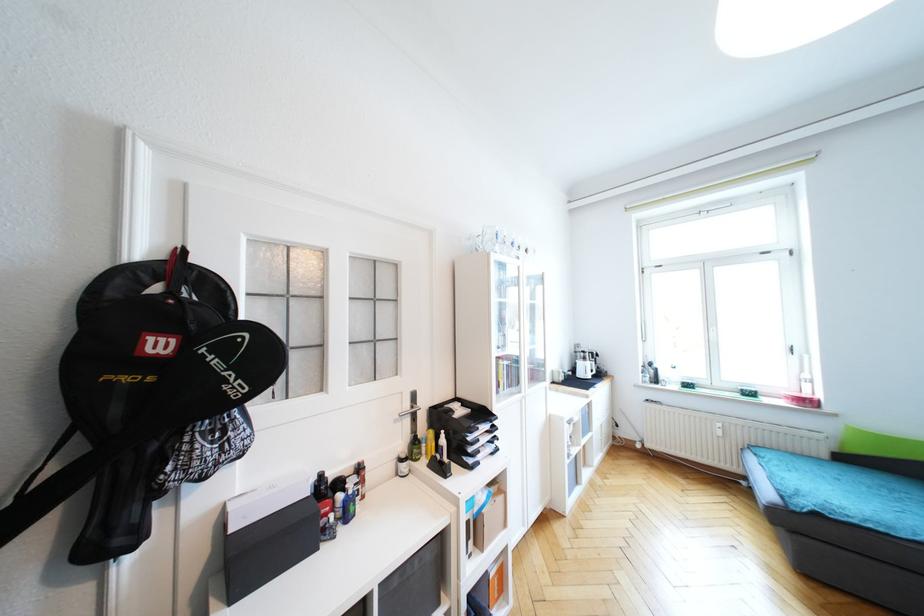
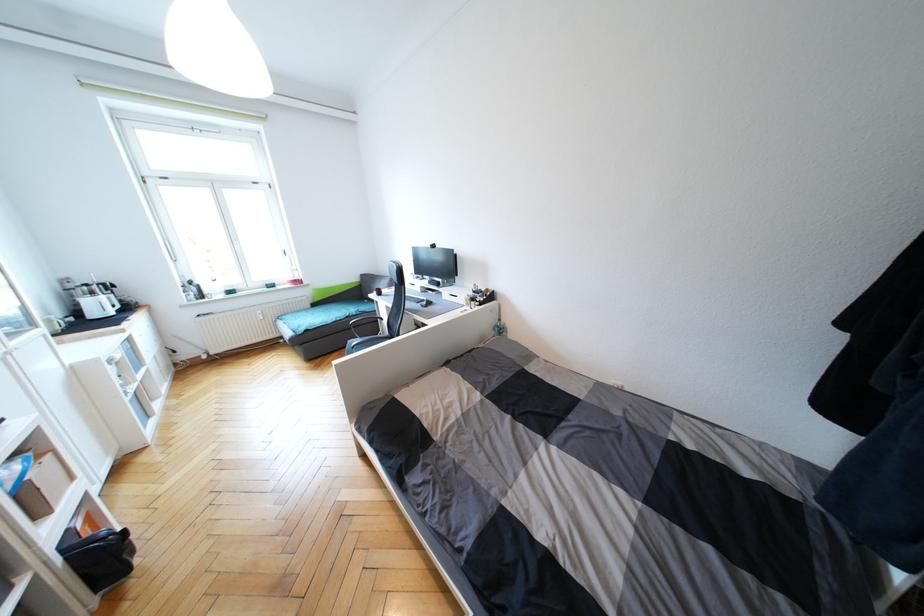
Where in the second image is the point corresponding to [602,377] from the first image?

(130, 309)